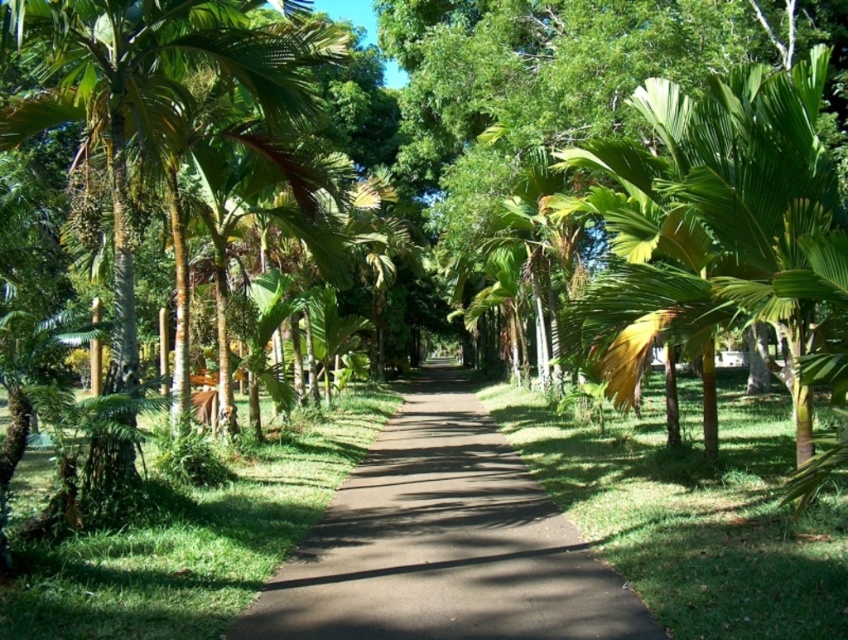
Question: Considering the relative positions of green leafy palm at center and brown asphalt pavement at center in the image provided, where is green leafy palm at center located with respect to brown asphalt pavement at center?

Choices:
 (A) below
 (B) above

Answer: (B)

Question: Which object is positioned farthest from the green leafy palm tree at left?

Choices:
 (A) brown asphalt pavement at center
 (B) green grass at center

Answer: (B)

Question: Among these points, which one is nearest to the camera?

Choices:
 (A) (746, 209)
 (B) (441, 401)
 (C) (192, 35)
 (D) (556, 426)

Answer: (A)

Question: Which point is closer to the camera taking this photo?

Choices:
 (A) (729, 452)
 (B) (501, 573)
 (C) (109, 99)

Answer: (B)

Question: In this image, where is green leafy palm at center located relative to brown asphalt pavement at center?

Choices:
 (A) right
 (B) left

Answer: (A)

Question: Can you confirm if green leafy palm at center is wider than green leafy palm tree at left?

Choices:
 (A) yes
 (B) no

Answer: (B)